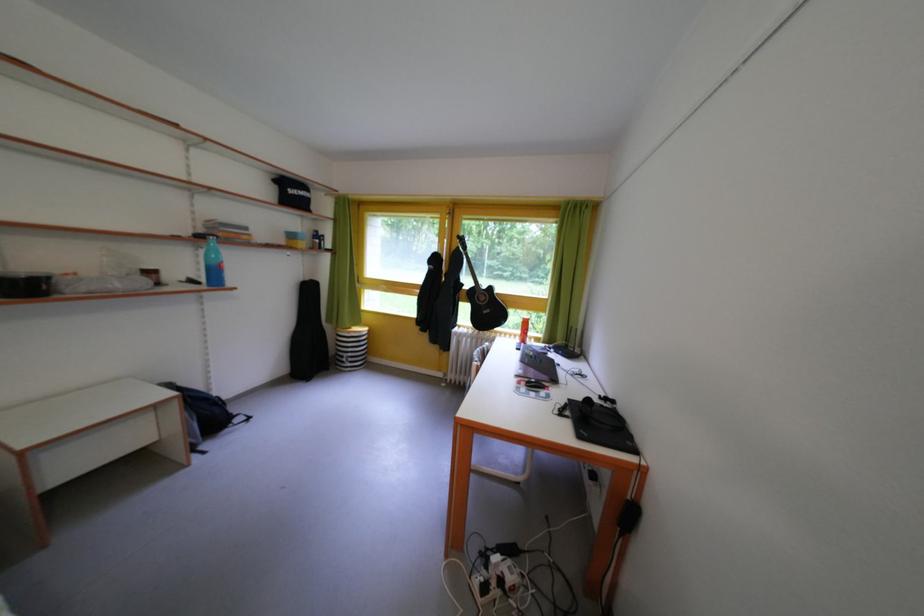
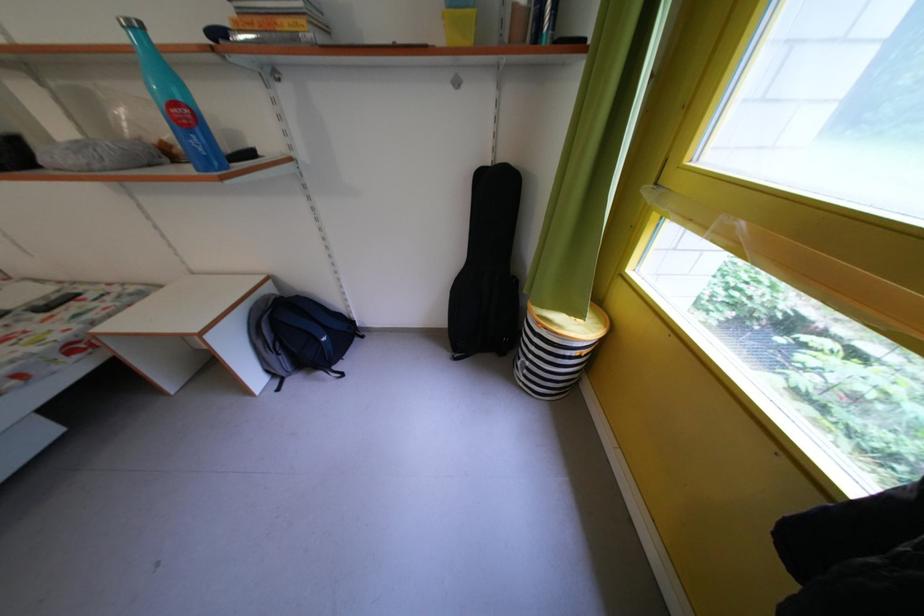
Locate, in the second image, the point that corresponds to pixel 359 360 in the first image.

(537, 369)